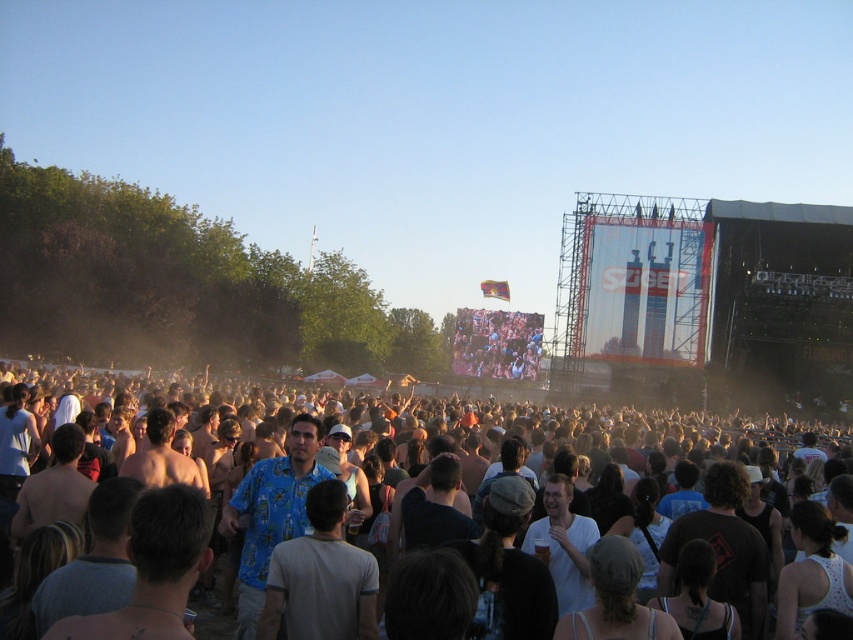
You are a photographer at the concert and want to capture both the white cotton shirt at center and the blue printed shirt at center in a single frame. Which shirt should you focus on first to ensure both are in the shot?

The white cotton shirt at center is below the blue printed shirt at center, so focusing on the blue printed shirt at center first would ensure both are captured in the frame.

Based on the photo, you are a photographer at the concert wanting to capture a photo of both the white cotton shirt at center and the blue printed shirt at center. Which shirt should you focus on first to ensure both are in clear focus?

The white cotton shirt at center is closer to the viewer than the blue printed shirt at center, so focusing on the white cotton shirt at center first will ensure both are in focus as the blue printed shirt at center is further away.